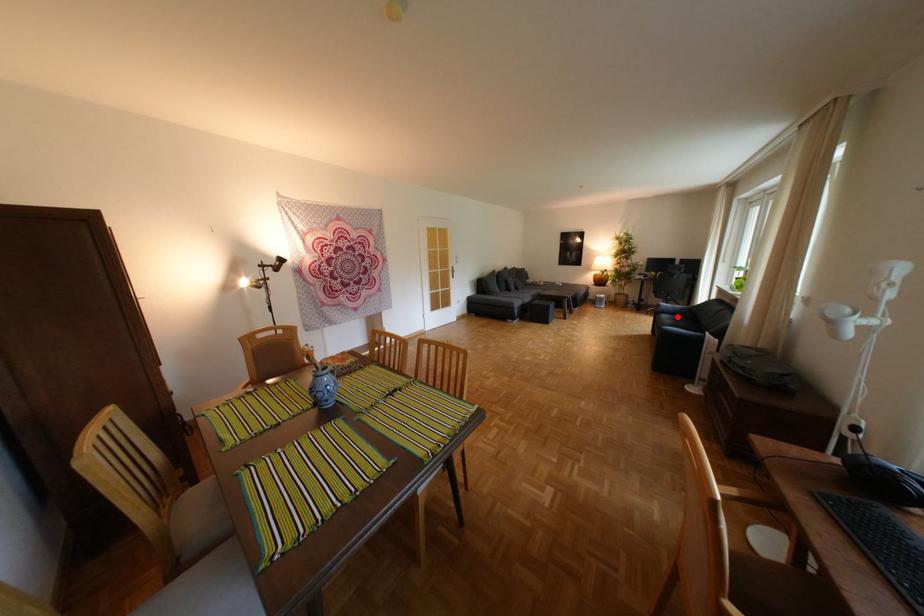
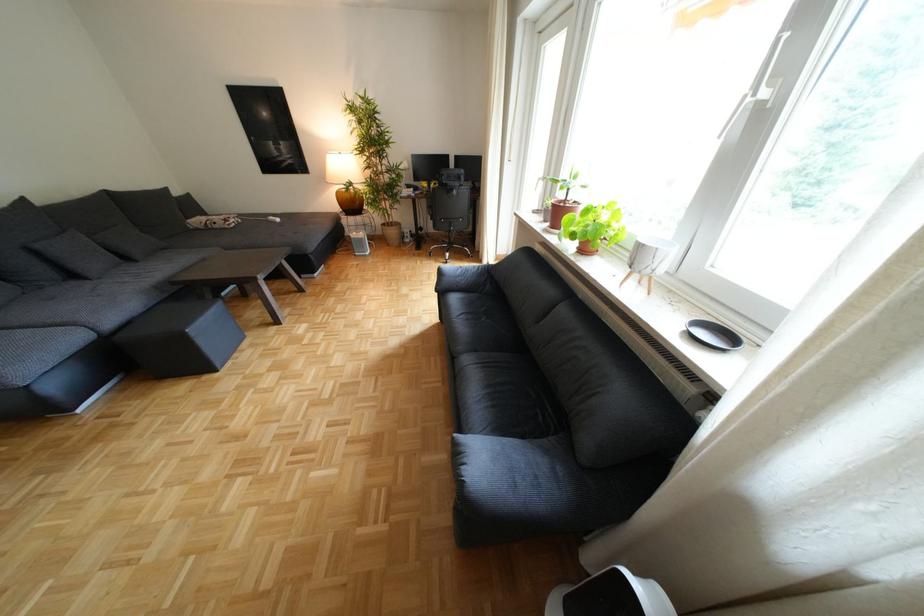
Question: I am providing you with two images of the same scene from different viewpoints. Given a red point in image1, look at the same physical point in image2. Is it:

Choices:
 (A) Closer to the viewpoint
 (B) Farther from the viewpoint

Answer: (B)